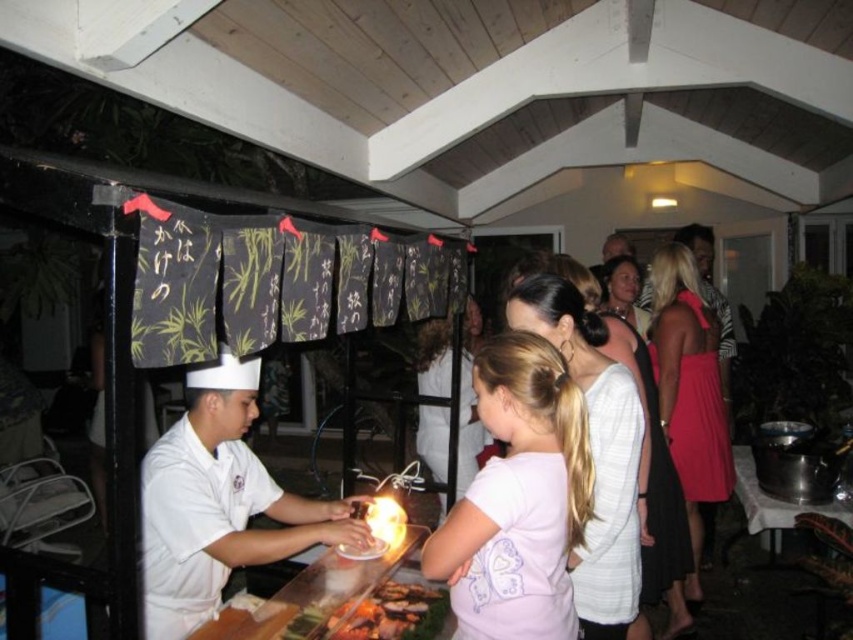
You are a guest at the event and want to take a photo of the chef and the light pink fabric. Since the light pink fabric at center is smaller than the white uniform at center, which one should you focus on to ensure both are visible in the frame?

The light pink fabric at center is smaller than the white uniform at center. To ensure both are visible in the frame, focus on the white uniform at center since it is larger and can accommodate the smaller light pink fabric within the same view.

You are attending a night event at a wooden pavilion and see two guests wearing a white matte dress at center and a matte pink dress at right. Which guest is standing to the left of the other?

The white matte dress at center is positioned on the left side of matte pink dress at right, so the guest wearing the white matte dress at center is standing to the left of the guest in the matte pink dress at right.

You are a guest at the event and want to take a photo of the chef cooking the grilled meat at center and his smooth skin face at center. Which object should you focus on first to ensure both are in the frame?

The grilled meat at center is positioned on the left side of smooth skin face at center, so you should focus on the grilled meat at center first to ensure both are in the frame.